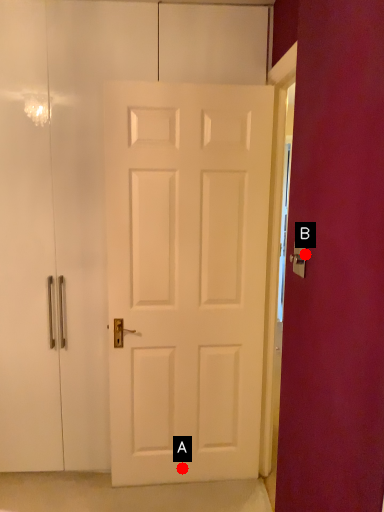
Question: Two points are circled on the image, labeled by A and B beside each circle. Which point is closer to the camera?

Choices:
 (A) A is closer
 (B) B is closer

Answer: (B)